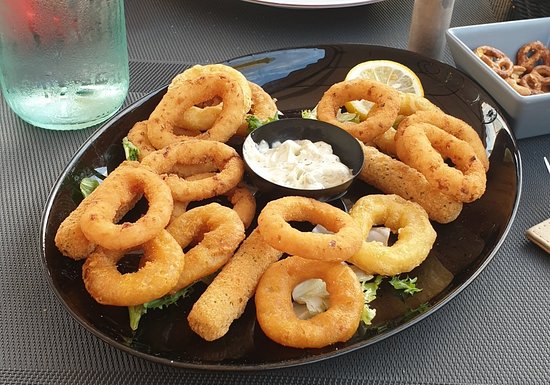
This screenshot has width=550, height=385. In order to click on black bowl in this screenshot , I will do `click(482, 237)`.